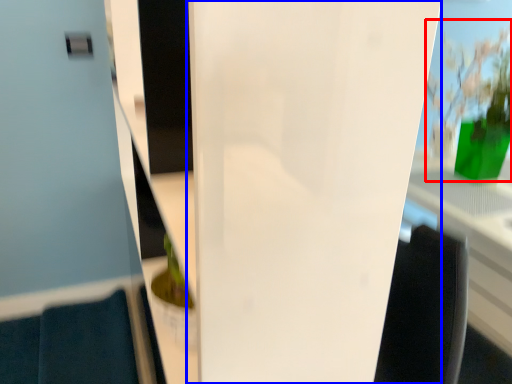
Question: Which object appears closest to the camera in this image, floral arrangement (highlighted by a red box) or glass door (highlighted by a blue box)?

Choices:
 (A) floral arrangement
 (B) glass door

Answer: (B)